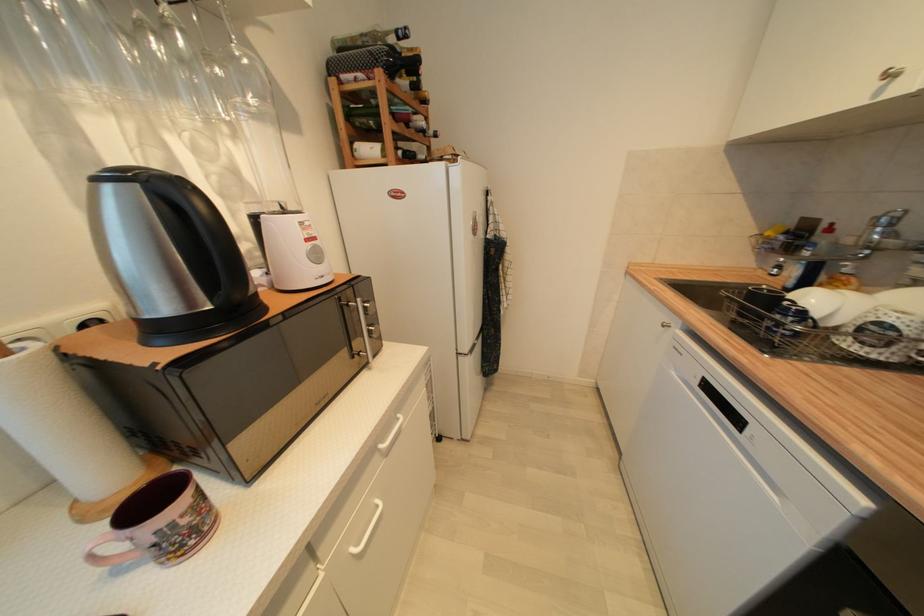
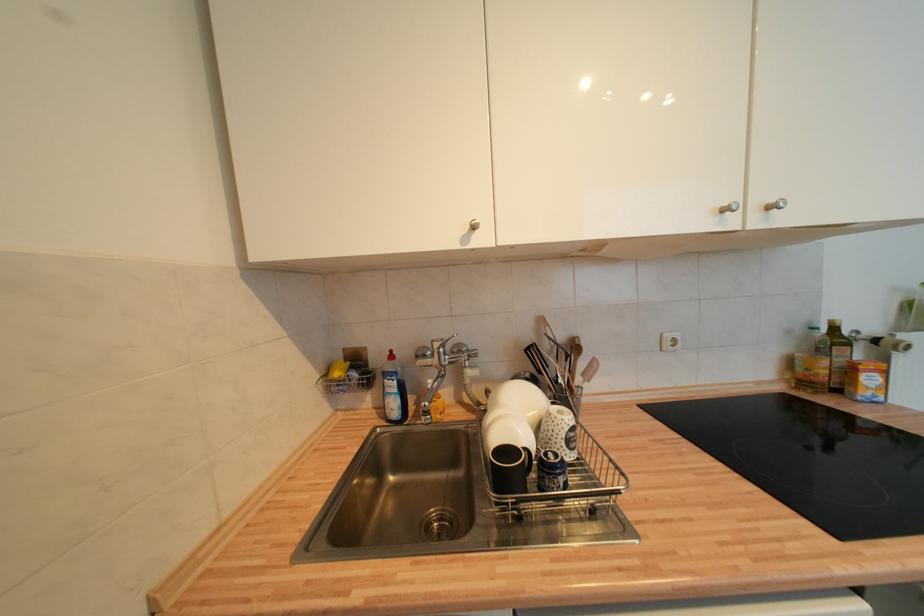
Locate, in the second image, the point that corresponds to (x=773, y=235) in the first image.

(343, 376)